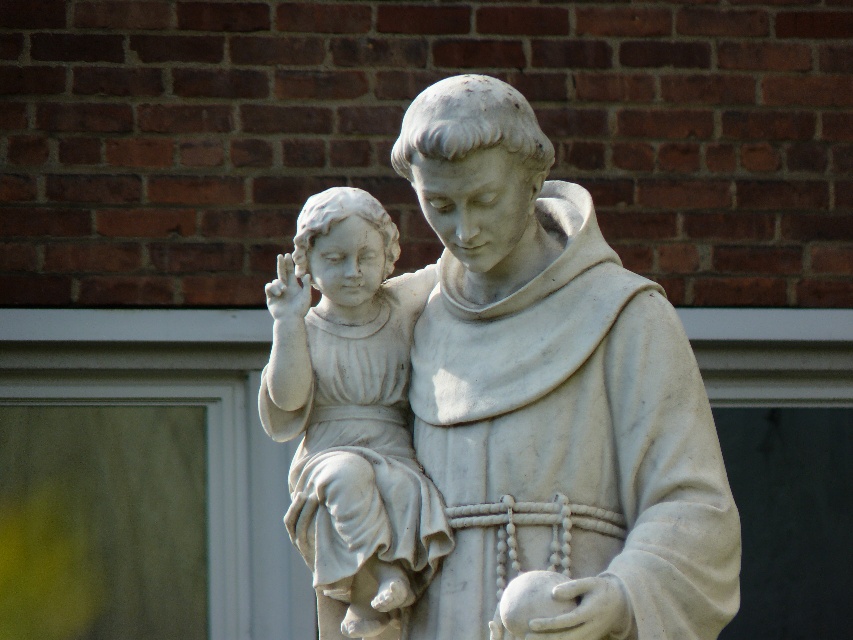
You are an art student standing in front of a gallery wall. You see the white marble statue at center and the white marble statue at left. Which statue is positioned lower on the wall?

The white marble statue at center is positioned lower on the wall because it is below the white marble statue at left.